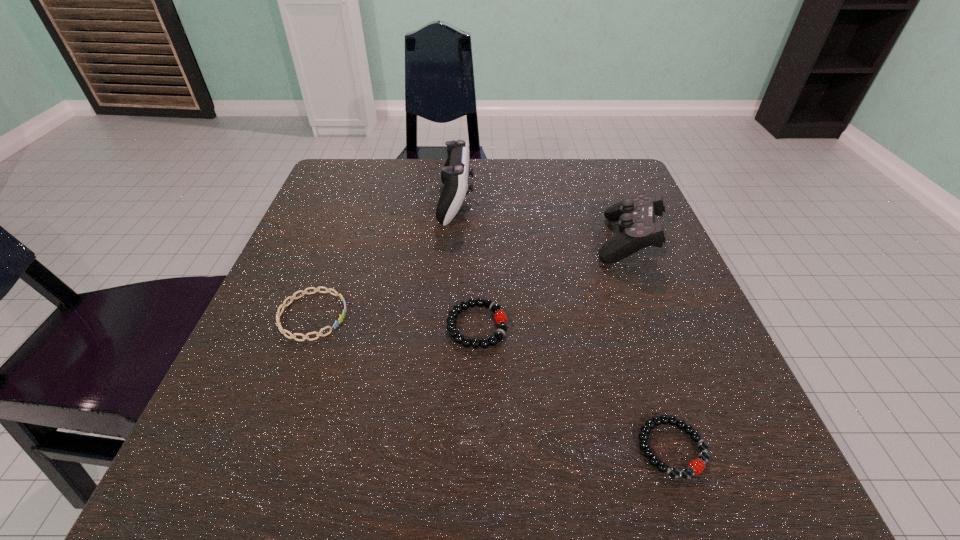
Where is `vacant area at the near edge`? vacant area at the near edge is located at coordinates (605, 502).

Where is `vacant space at the left edge of the desktop`? This screenshot has width=960, height=540. vacant space at the left edge of the desktop is located at coordinates (297, 253).

Locate an element on the screen. free space at the right edge of the desktop is located at coordinates (727, 386).

What are the coordinates of `vacant region at the far left corner of the desktop` in the screenshot? It's located at (341, 159).

The height and width of the screenshot is (540, 960). Identify the location of free spot between the nearest object and the right control. (x=649, y=343).

Where is `free spot between the taller control and the second bracelet from right to left`? Image resolution: width=960 pixels, height=540 pixels. free spot between the taller control and the second bracelet from right to left is located at coordinates [467, 265].

The image size is (960, 540). I want to click on vacant area between the shorter control and the taller control, so click(x=541, y=221).

Where is `blank region between the nearest object and the second bracelet from left to right`? The height and width of the screenshot is (540, 960). blank region between the nearest object and the second bracelet from left to right is located at coordinates (574, 387).

In order to click on blank region between the second bracelet from right to left and the right control in this screenshot , I will do `click(552, 282)`.

The image size is (960, 540). Identify the location of free space that is in between the leftmost bracelet and the second bracelet from left to right. (395, 321).